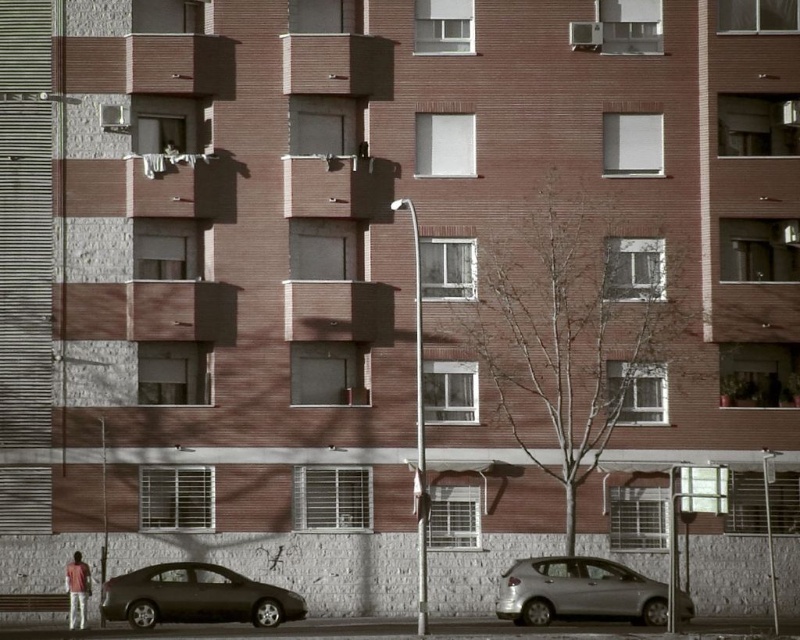
Looking at this image, you are standing at the point marked by the coordinates point (196,596). What object are you standing on?

You are standing on the matte black sedan at lower left.

From the picture: You are standing in front of the residential building and see two points marked on the ground. The first point is at coordinate point [582,561] and the second is at point [78,600]. Which point is closer to your current position?

Point [582,561] is closer to the camera than point [78,600], so the first point is closer to your current position.